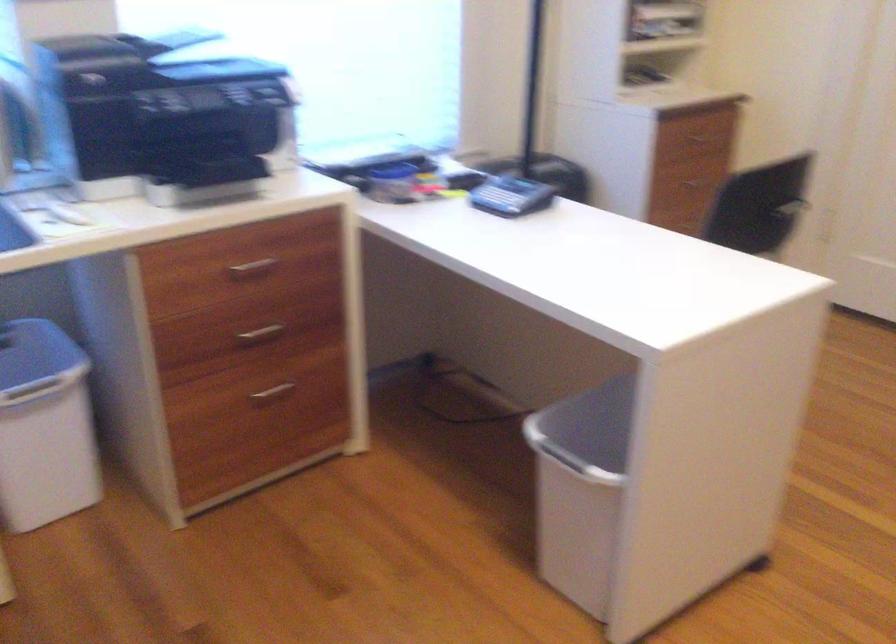
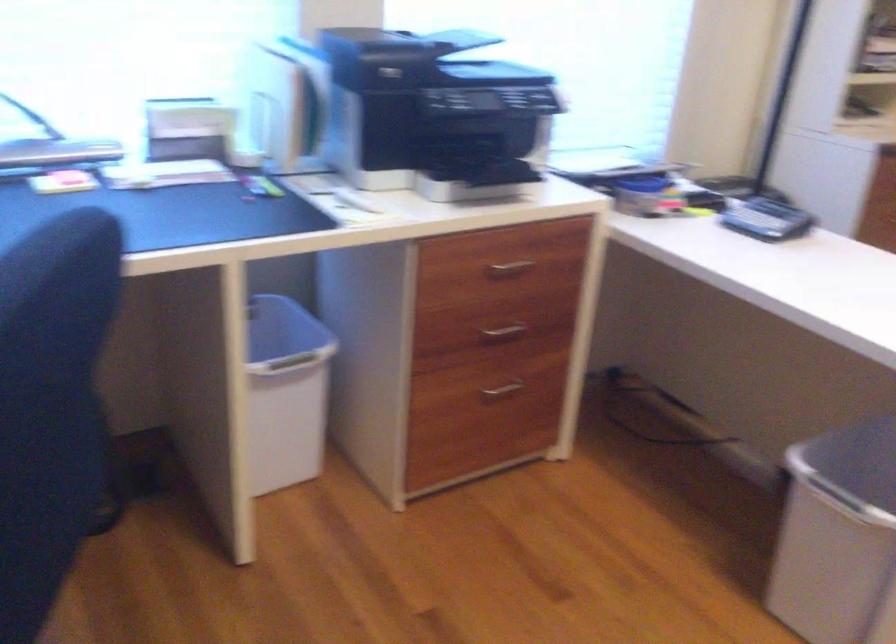
Find the pixel in the second image that matches point 608,430 in the first image.

(851, 467)